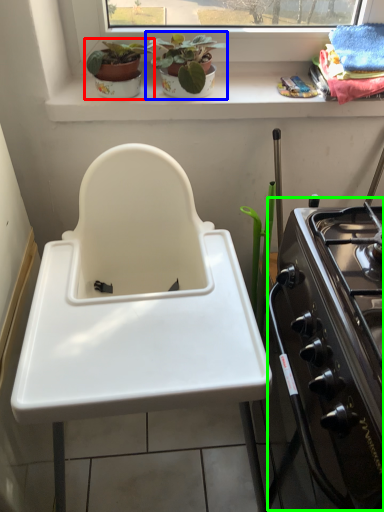
Question: Based on their relative distances, which object is farther from houseplant (highlighted by a red box)? Choose from houseplant (highlighted by a blue box) and oven (highlighted by a green box).

Choices:
 (A) houseplant
 (B) oven

Answer: (B)